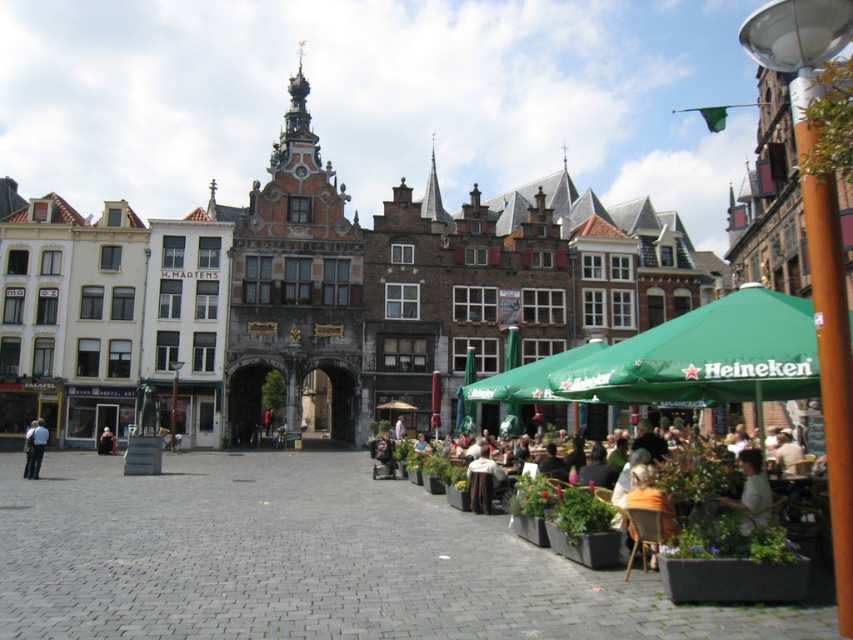
Which is below, green fabric umbrella at lower right or dark blue jeans at center?

Positioned lower is dark blue jeans at center.

Is green fabric umbrella at lower right further to camera compared to dark blue jeans at center?

No.

Is point (747, 465) closer to camera compared to point (102, 452)?

Yes.

The width and height of the screenshot is (853, 640). I want to click on green fabric umbrella at lower right, so click(x=752, y=492).

Is light blue jeans at lower left smaller than dark blue jeans at center?

No.

Who is positioned more to the right, light blue jeans at lower left or dark blue jeans at center?

From the viewer's perspective, dark blue jeans at center appears more on the right side.

You are a GUI agent. You are given a task and a screenshot of the screen. Output one action in this format:
    pyautogui.click(x=<x>, y=<y>)
    Task: Click on the light blue jeans at lower left
    This screenshot has width=853, height=640.
    Given the screenshot: What is the action you would take?
    pyautogui.click(x=36, y=449)

Who is positioned more to the left, green fabric canopy at center or dark blue jeans at center?

dark blue jeans at center is more to the left.

Between point (791, 376) and point (111, 435), which one is positioned in front?

Point (791, 376)

Between point (598, 365) and point (115, 449), which one is positioned behind?

Point (115, 449)

The image size is (853, 640). I want to click on green fabric canopy at center, so click(x=706, y=355).